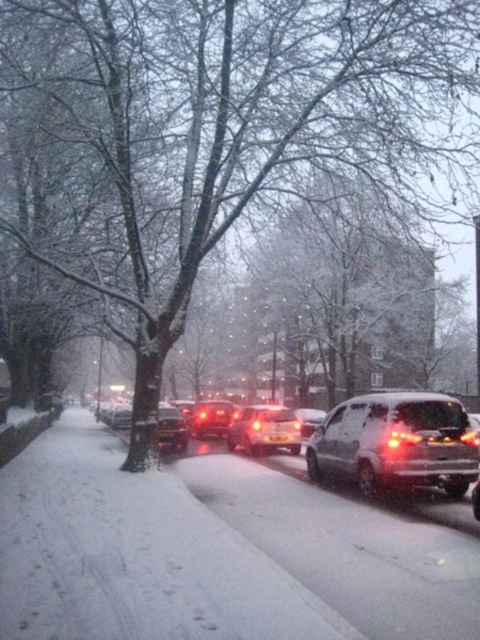
You are a delivery person trying to park your van between the matte red car at center and the shiny black sedan at center. Your van is 6 meters long. Can you fit your van between them without moving either car?

The distance between the matte red car at center and the shiny black sedan at center is 8.03 meters. Since your van is 6 meters long, there is enough space to park it between them without moving either car.

You are a delivery driver who needs to park your vehicle in this snowy scene. You see the sleek silver sedan at center and the black plastic license plate at center. Which object should you avoid hitting when backing up?

You should avoid hitting the sleek silver sedan at center because the black plastic license plate at center is located behind it, meaning the sedan is in front of the license plate and thus in your path when backing up.